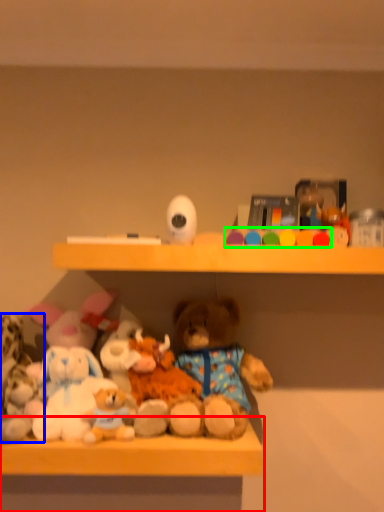
Question: Which is nearer to the table (highlighted by a red box)? toy (highlighted by a blue box) or toy (highlighted by a green box).

Choices:
 (A) toy
 (B) toy

Answer: (A)